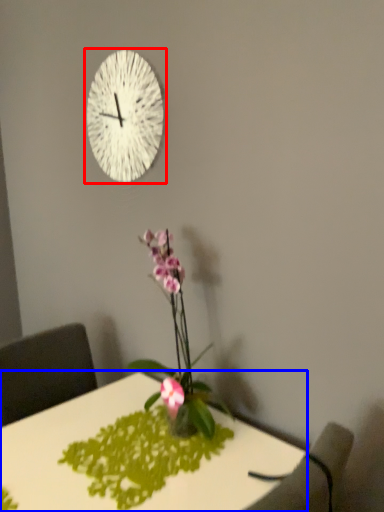
Question: Which object is closer to the camera taking this photo, wall clock (highlighted by a red box) or desk (highlighted by a blue box)?

Choices:
 (A) wall clock
 (B) desk

Answer: (B)